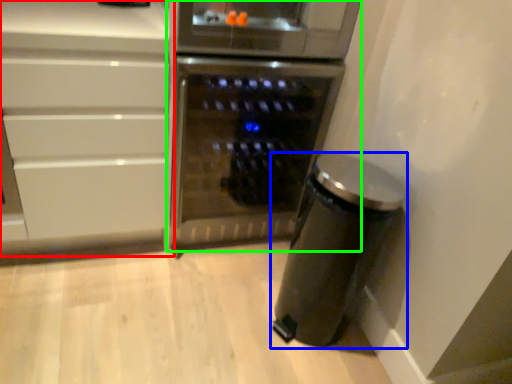
Question: Which is nearer to the cabinetry (highlighted by a red box)? kitchen appliance (highlighted by a blue box) or home appliance (highlighted by a green box).

Choices:
 (A) kitchen appliance
 (B) home appliance

Answer: (B)